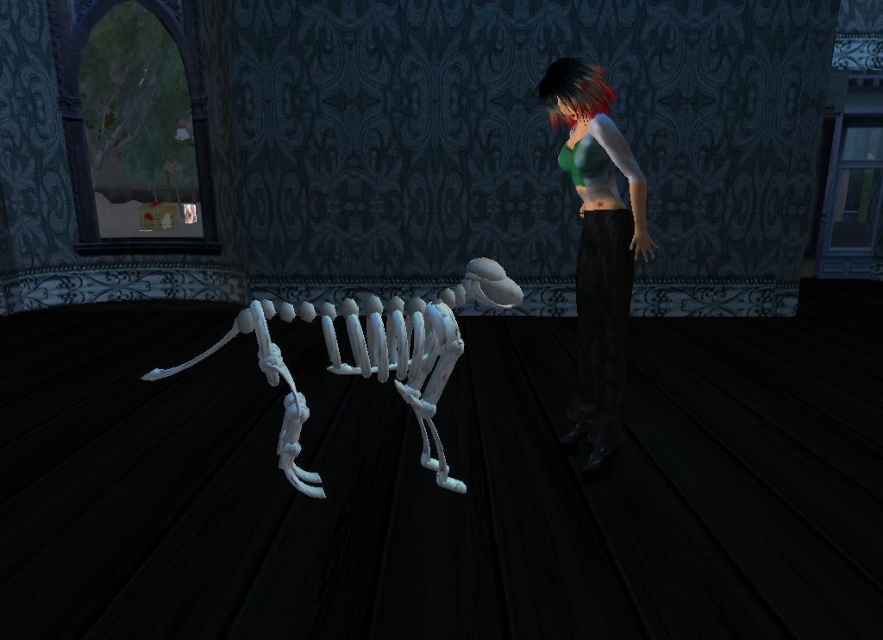
Question: Which of the following is the closest to the observer?

Choices:
 (A) green matte shirt at center
 (B) white matte skeleton at center

Answer: (B)

Question: Among these points, which one is nearest to the camera?

Choices:
 (A) (623, 218)
 (B) (440, 324)
 (C) (557, 104)

Answer: (B)

Question: Can you confirm if green matte shirt at center is bigger than white matte skeleton at center?

Choices:
 (A) no
 (B) yes

Answer: (A)

Question: Is green matte shirt at center to the right of shiny dark hair at upper center from the viewer's perspective?

Choices:
 (A) yes
 (B) no

Answer: (A)

Question: Does green matte shirt at center appear on the right side of white matte skeleton at center?

Choices:
 (A) no
 (B) yes

Answer: (B)

Question: Which of the following is the closest to the observer?

Choices:
 (A) shiny dark hair at upper center
 (B) green matte shirt at center

Answer: (B)